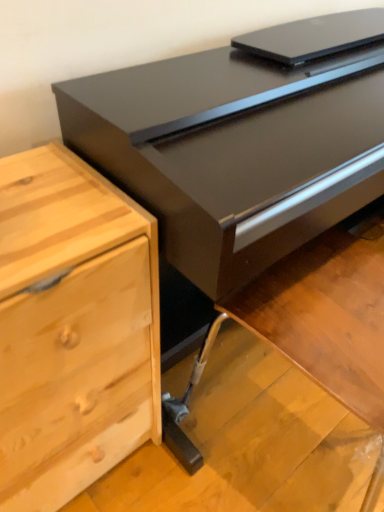
The height and width of the screenshot is (512, 384). What do you see at coordinates (73, 328) in the screenshot? I see `light wood chest of drawers at left` at bounding box center [73, 328].

Locate an element on the screen. The image size is (384, 512). light wood chest of drawers at left is located at coordinates (73, 328).

Locate an element on the screen. The width and height of the screenshot is (384, 512). light wood chest of drawers at left is located at coordinates (73, 328).